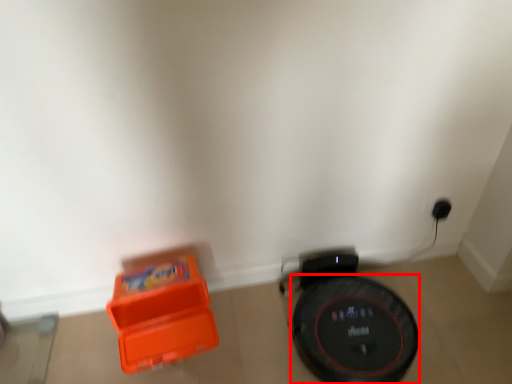
Question: From the image's perspective, where is wheel (annotated by the red box) located relative to toy?

Choices:
 (A) below
 (B) above

Answer: (A)